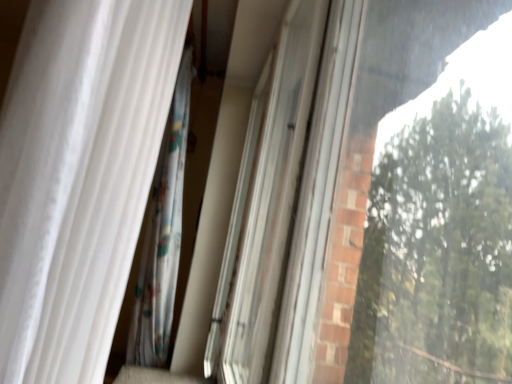
Question: Is white glossy screen door at center taller or shorter than white sheer curtain at left?

Choices:
 (A) tall
 (B) short

Answer: (A)

Question: In terms of size, does white glossy screen door at center appear bigger or smaller than white sheer curtain at left?

Choices:
 (A) big
 (B) small

Answer: (B)

Question: Based on their positions, is white glossy screen door at center located to the left or right of white sheer curtain at left?

Choices:
 (A) left
 (B) right

Answer: (B)

Question: From a real-world perspective, is white sheer curtain at left positioned above or below white glossy screen door at center?

Choices:
 (A) below
 (B) above

Answer: (B)

Question: Is point (31, 304) positioned closer to the camera than point (266, 284)?

Choices:
 (A) farther
 (B) closer

Answer: (B)

Question: From the image's perspective, is white sheer curtain at left positioned above or below white glossy screen door at center?

Choices:
 (A) below
 (B) above

Answer: (B)

Question: Considering their positions, is white sheer curtain at left located in front of or behind white glossy screen door at center?

Choices:
 (A) behind
 (B) front

Answer: (B)